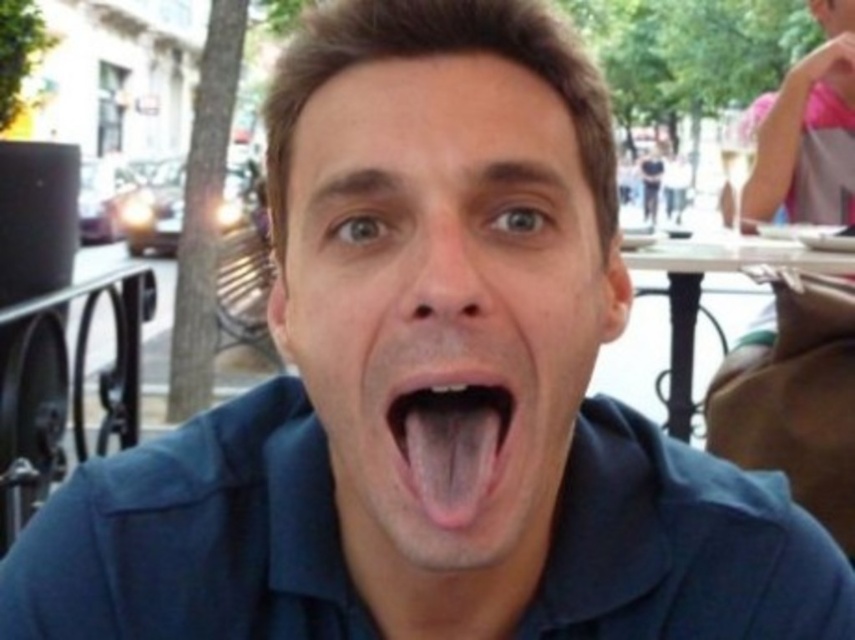
Question: Based on their relative distances, which object is farther from the matte blue face at center?

Choices:
 (A) pink flesh-colored tongue at center
 (B) white plastic table at center

Answer: (B)

Question: Is pink flesh-colored tongue at center bigger than white plastic table at center?

Choices:
 (A) no
 (B) yes

Answer: (A)

Question: Does matte blue face at center have a greater width compared to white plastic table at center?

Choices:
 (A) no
 (B) yes

Answer: (A)

Question: Which point is farther to the camera?

Choices:
 (A) matte blue face at center
 (B) white plastic table at center
 (C) pink flesh-colored tongue at center

Answer: (B)

Question: Estimate the real-world distances between objects in this image. Which object is closer to the matte blue face at center?

Choices:
 (A) pink flesh-colored tongue at center
 (B) white plastic table at center

Answer: (A)

Question: Where is matte blue face at center located in relation to white plastic table at center in the image?

Choices:
 (A) below
 (B) above

Answer: (A)